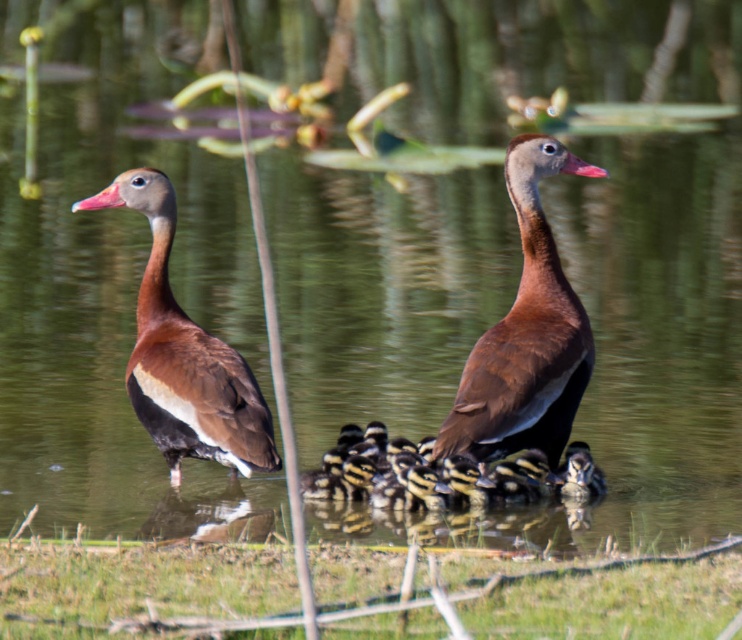
You are a photographer aiming to capture a photo of the brown matte duck at center and the green grass at lower center. If you want to ensure both the duck and the grass are fully visible in your frame, which object should you prioritize keeping closer to the camera?

The green grass at lower center is wider than the brown matte duck at center. Therefore, to ensure both are fully visible, prioritize keeping the brown matte duck at center closer to the camera since its narrower width requires less space in the frame compared to the wider green grass at lower center.

You are a small frog sitting on the green grass at lower center and want to jump to the brown matte duck at center. In which direction should you jump to reach it?

The green grass at lower center is positioned on the left side of brown matte duck at center, so the frog should jump to the right to reach it.

You are a photographer positioned at the edge of the wetland. You want to capture a photo of the brown matte duck at center without the green grass at lower center appearing in the foreground. Is this possible?

The green grass at lower center is in front of the brown matte duck at center, so it will block the view. Move your position to avoid the grass or adjust the angle to exclude it.